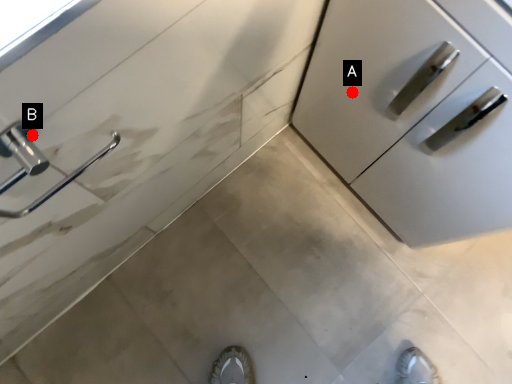
Question: Two points are circled on the image, labeled by A and B beside each circle. Which of the following is the closest to the observer?

Choices:
 (A) A is closer
 (B) B is closer

Answer: (B)